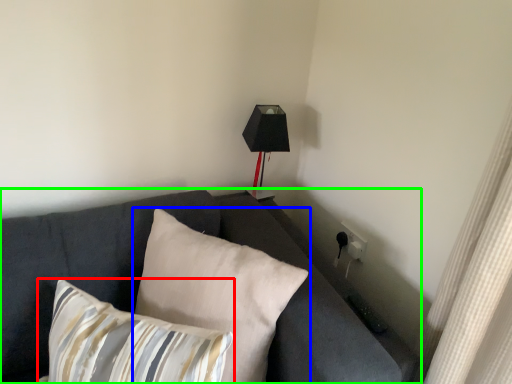
Question: Which object is the farthest from pillow (highlighted by a red box)? Choose among these: pillow (highlighted by a blue box) or studio couch (highlighted by a green box).

Choices:
 (A) pillow
 (B) studio couch

Answer: (B)